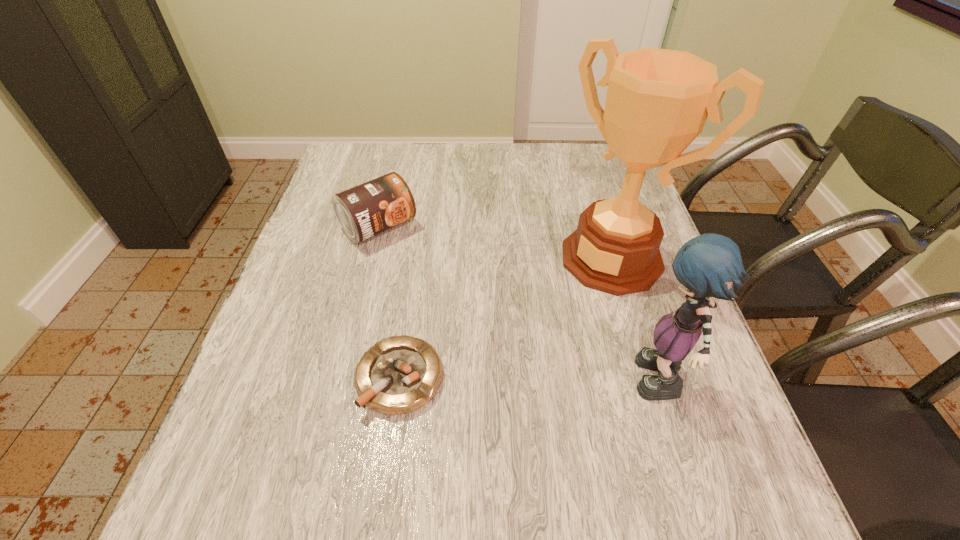
Locate an element on the screen. free space between the can and the ashtray is located at coordinates pos(389,302).

At what (x,y) coordinates should I click in order to perform the action: click on free space that is in between the tallest object and the shortest object. Please return your answer as a coordinate pair (x, y). This screenshot has height=540, width=960. Looking at the image, I should click on (506, 318).

The image size is (960, 540). Find the location of `vacant area that lies between the shortest object and the can`. vacant area that lies between the shortest object and the can is located at coordinates (389, 302).

Locate an element on the screen. This screenshot has height=540, width=960. empty space that is in between the second shortest object and the tallest object is located at coordinates (495, 242).

Where is `vacant space that's between the tallest object and the can`? vacant space that's between the tallest object and the can is located at coordinates (495, 242).

This screenshot has height=540, width=960. In order to click on free space between the tallest object and the ashtray in this screenshot , I will do `click(506, 318)`.

Identify which object is the nearest to the third tallest object. Please provide its 2D coordinates. Your answer should be formatted as a tuple, i.e. [(x, y)], where the tuple contains the x and y coordinates of a point satisfying the conditions above.

[(400, 374)]

Find the location of a particular element. The height and width of the screenshot is (540, 960). the closest object relative to the third tallest object is located at coordinates (400, 374).

This screenshot has width=960, height=540. In order to click on vacant area that satisfies the following two spatial constraints: 1. on the front side of the rag doll; 2. on the front-facing side of the ashtray in this screenshot , I will do pyautogui.click(x=398, y=387).

Find the location of a particular element. This screenshot has height=540, width=960. vacant space that satisfies the following two spatial constraints: 1. on the front side of the shortest object; 2. on the front-facing side of the rag doll is located at coordinates (398, 387).